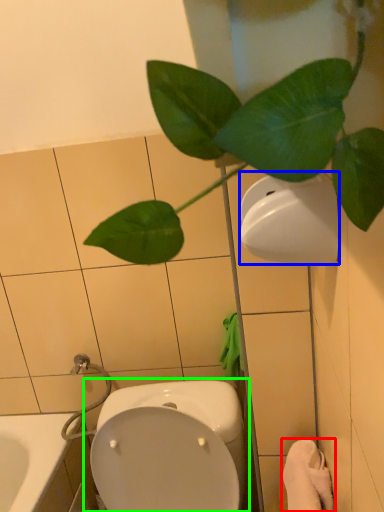
Question: Estimate the real-world distances between objects in this image. Which object is farther from bath towel (highlighted by a red box), toilet paper (highlighted by a blue box) or toilet (highlighted by a green box)?

Choices:
 (A) toilet paper
 (B) toilet

Answer: (A)